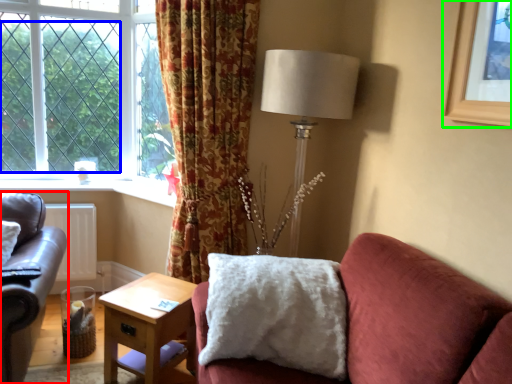
Question: Considering the real-world distances, which object is farthest from studio couch (highlighted by a red box)? tree (highlighted by a blue box) or picture frame (highlighted by a green box)?

Choices:
 (A) tree
 (B) picture frame

Answer: (B)